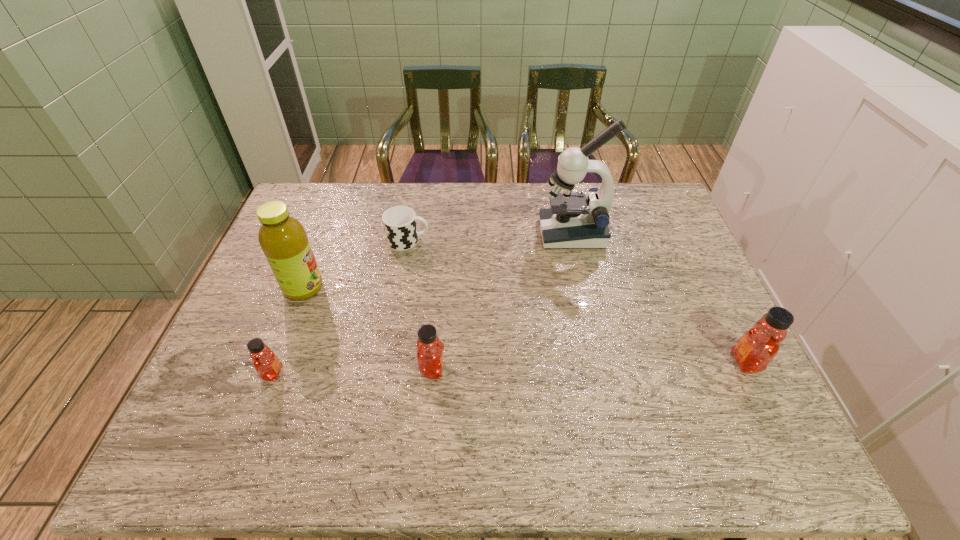
The width and height of the screenshot is (960, 540). Find the location of `the tallest object`. the tallest object is located at coordinates (573, 221).

Find the location of a particular element. the second object from right to left is located at coordinates click(573, 221).

Identify the location of free space located 0.310m on the front label of the fifth tallest object. Image resolution: width=960 pixels, height=540 pixels. (413, 373).

Locate an element on the screen. This screenshot has height=540, width=960. vacant space located on the front label of the second shortest honey is located at coordinates (521, 369).

The width and height of the screenshot is (960, 540). What are the coordinates of `vacant space located on the front label of the fourth shortest object` in the screenshot? It's located at (685, 362).

Where is `free space located on the front label of the fourth shortest object`? Image resolution: width=960 pixels, height=540 pixels. free space located on the front label of the fourth shortest object is located at coordinates (636, 362).

The height and width of the screenshot is (540, 960). Identify the location of blank space located 0.160m on the front label of the fourth shortest object. (664, 362).

Locate an element on the screen. free space located 0.260m on the side of the cup with the handle is located at coordinates (512, 241).

In order to click on vacant region located on the front label of the third farthest object in this screenshot , I will do `click(355, 288)`.

At what (x,y) coordinates should I click in order to perform the action: click on blank space located on the front of the tallest object. Please return your answer as a coordinate pair (x, y). This screenshot has width=960, height=540. Looking at the image, I should click on (582, 278).